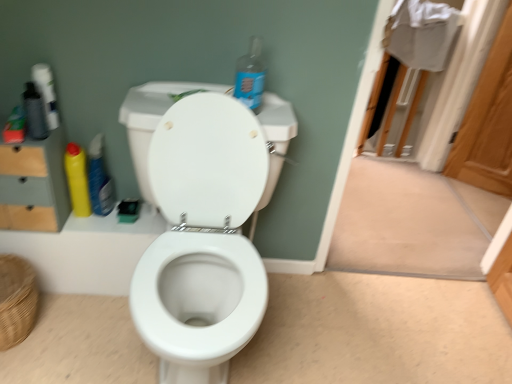
Identify the location of free point in front of yellow plastic bottle at left, marked as the 2th cleaning product in a right-to-left arrangement. (92, 225).